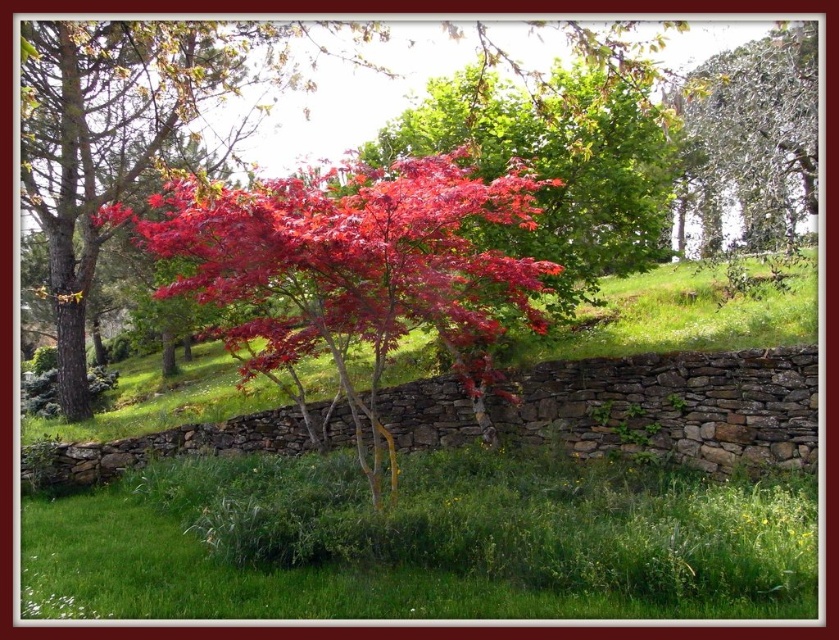
Question: Among these points, which one is farthest from the camera?

Choices:
 (A) (150, 154)
 (B) (722, 132)
 (C) (128, 516)
 (D) (209, 275)

Answer: (A)

Question: Is glossy red maple at center closer to the viewer compared to green leafy tree at upper right?

Choices:
 (A) no
 (B) yes

Answer: (B)

Question: Is green grass at lower center positioned in front of glossy red maple at center?

Choices:
 (A) no
 (B) yes

Answer: (B)

Question: Among these points, which one is nearest to the camera?

Choices:
 (A) (576, 488)
 (B) (753, 148)
 (C) (280, 28)
 (D) (242, 268)

Answer: (D)

Question: Does glossy red maple tree at center lie in front of green leafy tree at upper right?

Choices:
 (A) yes
 (B) no

Answer: (A)

Question: Which is farther from the green leafy tree at upper right?

Choices:
 (A) green grass at lower center
 (B) glossy red maple tree at center
 (C) glossy red maple at center

Answer: (A)